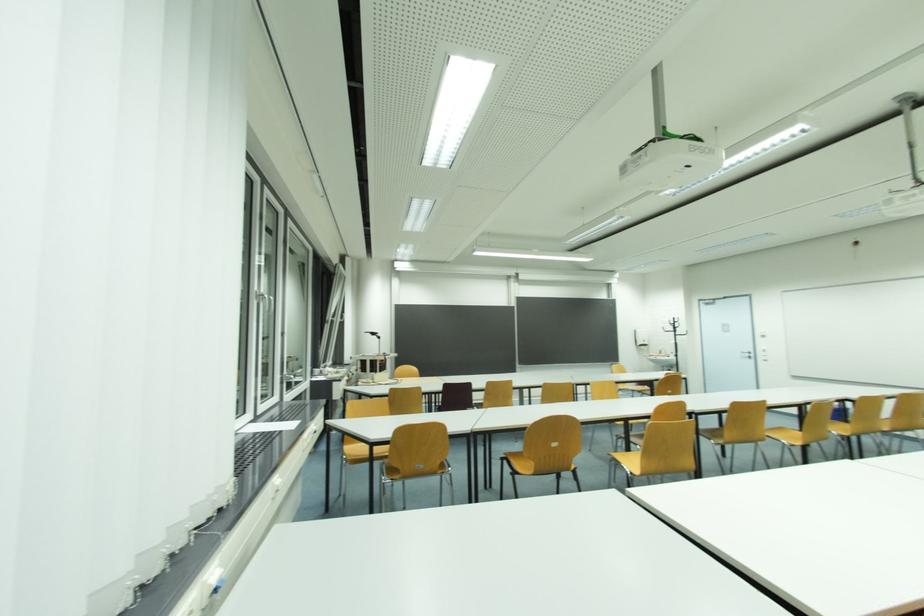
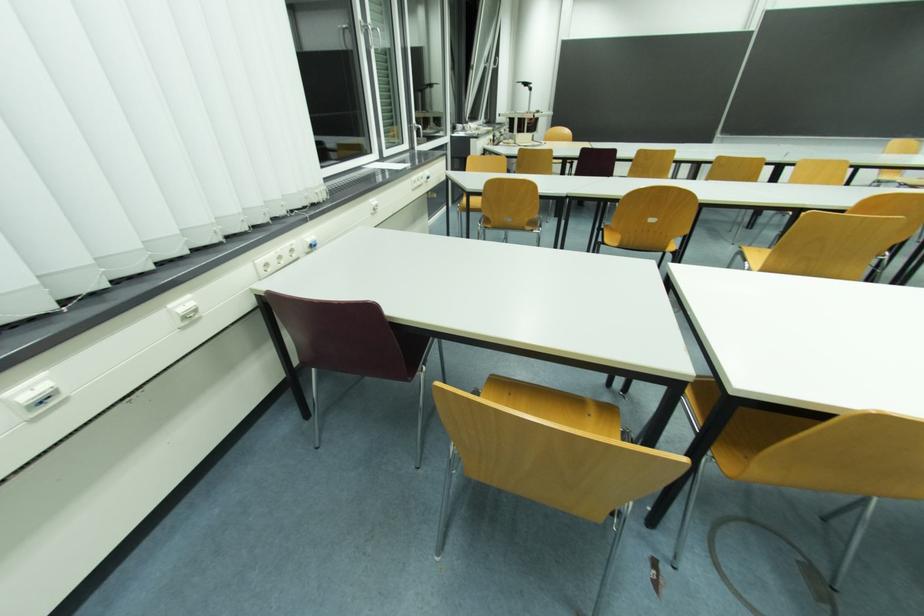
First-person continuous shooting, in which direction is the camera rotating?

The rotation direction of the camera is left-down.